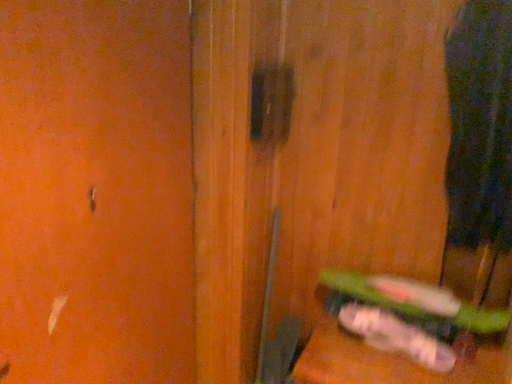
Where is `green plastic toothbrush at lower right`? green plastic toothbrush at lower right is located at coordinates (416, 305).

What do you see at coordinates (416, 305) in the screenshot? The width and height of the screenshot is (512, 384). I see `green plastic toothbrush at lower right` at bounding box center [416, 305].

In order to face green plastic toothbrush at lower right, should I rotate leftwards or rightwards?

To face it directly, rotate right by 19.002 degrees.

At what (x,y) coordinates should I click in order to perform the action: click on green plastic toothbrush at lower right. Please return your answer as a coordinate pair (x, y). The height and width of the screenshot is (384, 512). Looking at the image, I should click on (416, 305).